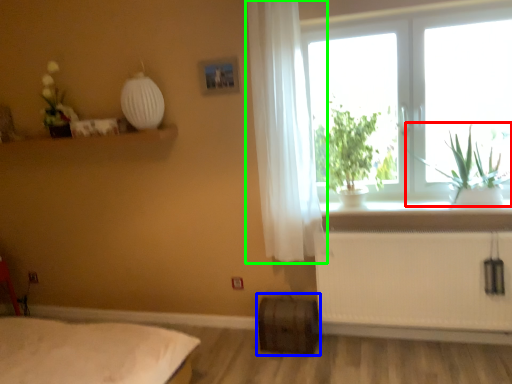
Question: Which is nearer to the plant (highlighted by a red box)? window box (highlighted by a blue box) or curtain (highlighted by a green box).

Choices:
 (A) window box
 (B) curtain

Answer: (B)